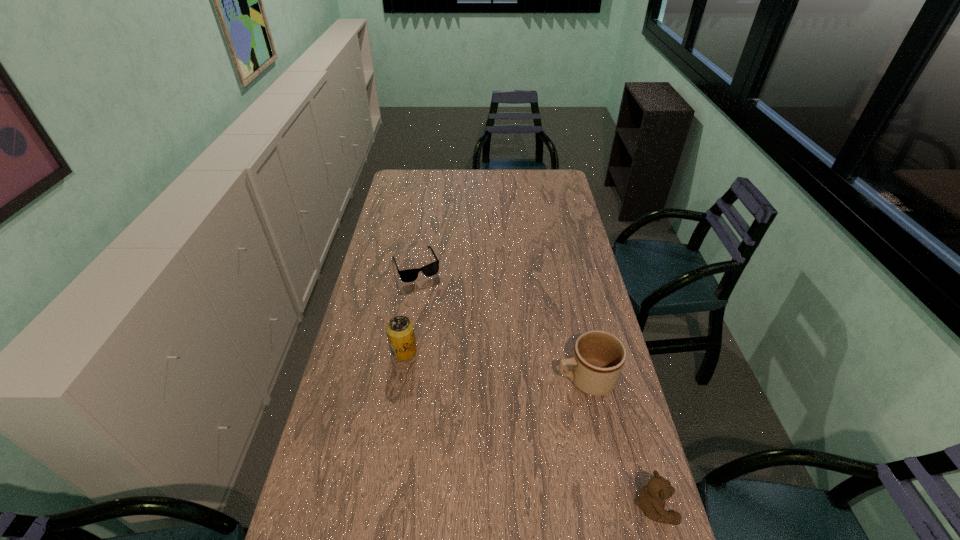
Identify the location of free spot at the left edge of the desktop. (383, 278).

This screenshot has height=540, width=960. In order to click on free spot at the right edge of the desktop in this screenshot , I will do `click(603, 402)`.

Where is `blank area at the far left corner`? The width and height of the screenshot is (960, 540). blank area at the far left corner is located at coordinates (393, 192).

Locate an element on the screen. vacant space at the far right corner is located at coordinates (550, 191).

This screenshot has width=960, height=540. Find the location of `vacant space at the near right corner`. vacant space at the near right corner is located at coordinates (631, 526).

This screenshot has height=540, width=960. Identify the location of empty space that is in between the farthest object and the beer can. (410, 308).

Locate an element on the screen. This screenshot has height=540, width=960. free space between the sunglasses and the mug is located at coordinates (500, 322).

Identify the location of free space between the mug and the beer can. (494, 365).

At what (x,y) coordinates should I click in order to perform the action: click on vacant area between the nearest object and the sunglasses. Please return your answer as a coordinate pair (x, y). Looking at the image, I should click on (535, 386).

The width and height of the screenshot is (960, 540). In order to click on empty location between the beer can and the teddy bear in this screenshot , I will do `click(529, 428)`.